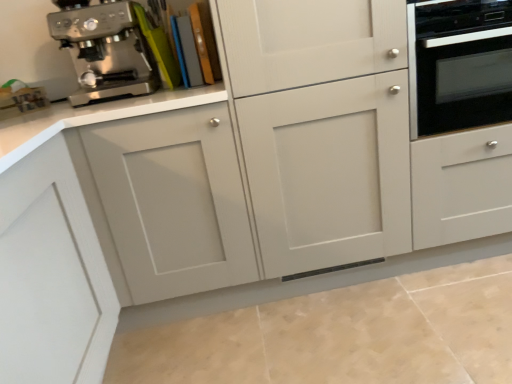
Question: Is stainless steel coffee maker at upper left at the right side of black glass oven at right?

Choices:
 (A) yes
 (B) no

Answer: (B)

Question: Is stainless steel coffee maker at upper left facing towards black glass oven at right?

Choices:
 (A) no
 (B) yes

Answer: (A)

Question: Is stainless steel coffee maker at upper left positioned with its back to black glass oven at right?

Choices:
 (A) yes
 (B) no

Answer: (B)

Question: Is stainless steel coffee maker at upper left to the left of black glass oven at right from the viewer's perspective?

Choices:
 (A) yes
 (B) no

Answer: (A)

Question: Does stainless steel coffee maker at upper left have a greater width compared to black glass oven at right?

Choices:
 (A) no
 (B) yes

Answer: (A)

Question: Is stainless steel coffee maker at upper left beside black glass oven at right?

Choices:
 (A) yes
 (B) no

Answer: (B)

Question: Considering the relative sizes of black glass oven at right and stainless steel coffee maker at upper left in the image provided, is black glass oven at right wider than stainless steel coffee maker at upper left?

Choices:
 (A) no
 (B) yes

Answer: (B)

Question: Does black glass oven at right have a lesser height compared to stainless steel coffee maker at upper left?

Choices:
 (A) no
 (B) yes

Answer: (A)

Question: Is the position of black glass oven at right more distant than that of stainless steel coffee maker at upper left?

Choices:
 (A) yes
 (B) no

Answer: (B)

Question: Does black glass oven at right turn towards stainless steel coffee maker at upper left?

Choices:
 (A) yes
 (B) no

Answer: (B)

Question: Considering the relative sizes of black glass oven at right and stainless steel coffee maker at upper left in the image provided, is black glass oven at right smaller than stainless steel coffee maker at upper left?

Choices:
 (A) yes
 (B) no

Answer: (B)

Question: From the image's perspective, does black glass oven at right appear higher than stainless steel coffee maker at upper left?

Choices:
 (A) no
 (B) yes

Answer: (A)

Question: Is stainless steel coffee maker at upper left in front of or behind black glass oven at right in the image?

Choices:
 (A) behind
 (B) front

Answer: (A)